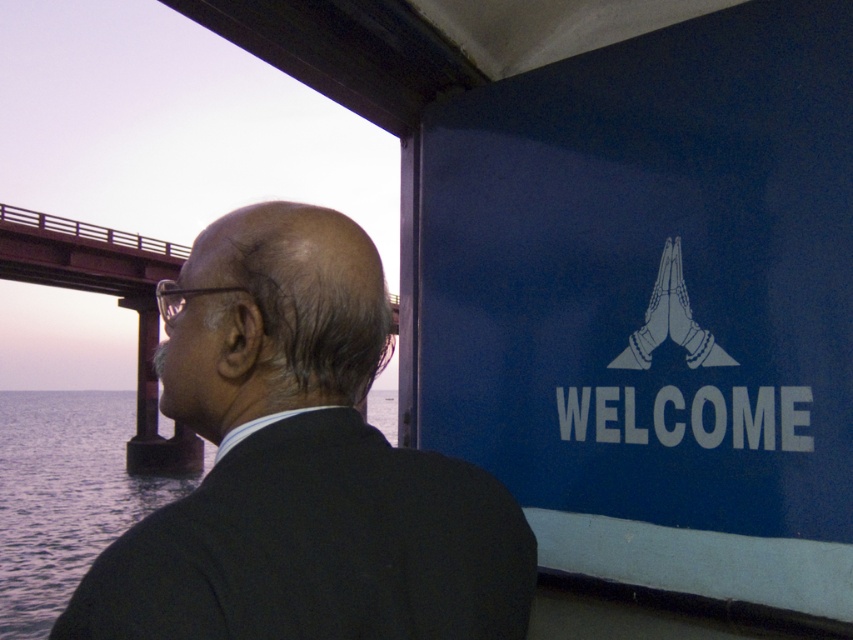
Question: Which of these objects is positioned closest to the rusty metal bridge at left?

Choices:
 (A) dark blue water at left
 (B) black suit at center

Answer: (A)

Question: Does black suit at center have a smaller size compared to rusty metal bridge at left?

Choices:
 (A) no
 (B) yes

Answer: (B)

Question: Among these objects, which one is nearest to the camera?

Choices:
 (A) black suit at center
 (B) rusty metal bridge at left
 (C) dark blue water at left

Answer: (A)

Question: Is dark blue water at left thinner than rusty metal bridge at left?

Choices:
 (A) no
 (B) yes

Answer: (A)

Question: Which of the following is the closest to the observer?

Choices:
 (A) black suit at center
 (B) rusty metal bridge at left

Answer: (A)

Question: Does black suit at center have a greater width compared to dark blue water at left?

Choices:
 (A) yes
 (B) no

Answer: (B)